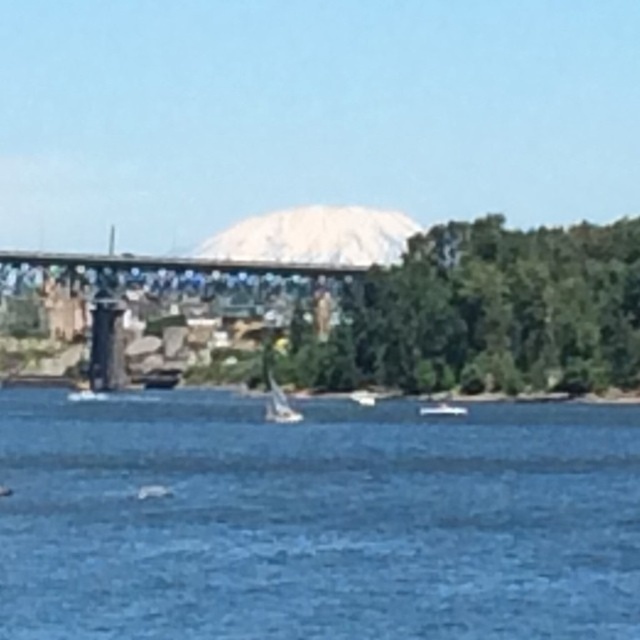
Who is lower down, blue water at center or white glossy boat at center?

white glossy boat at center

Between point (221, 400) and point (438, 403), which one is positioned behind?

Positioned behind is point (221, 400).

Which is behind, point (45, 396) or point (444, 408)?

Point (45, 396)

At what (x,y) coordinates should I click in order to perform the action: click on blue water at center. Please return your answer as a coordinate pair (x, y). Looking at the image, I should click on (316, 518).

Does metal bridge at center have a larger size compared to white glossy boat at center?

Indeed, metal bridge at center has a larger size compared to white glossy boat at center.

Does metal bridge at center appear under white glossy boat at center?

No.

Locate an element on the screen. metal bridge at center is located at coordinates (179, 262).

Between blue water at center and metal bridge at center, which one is positioned higher?

metal bridge at center is higher up.

Which is in front, point (280, 513) or point (112, 266)?

Point (280, 513) is in front.

Where is `blue water at center`? This screenshot has height=640, width=640. blue water at center is located at coordinates (316, 518).